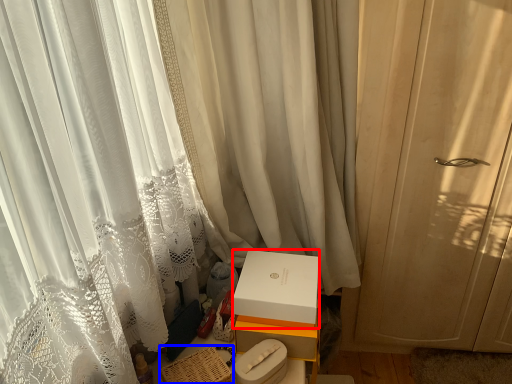
Question: Which point is further to the camera, box (highlighted by a red box) or basket (highlighted by a blue box)?

Choices:
 (A) box
 (B) basket

Answer: (A)